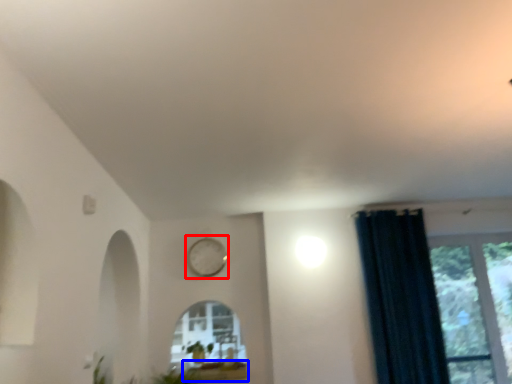
Question: Among these objects, which one is nearest to the camera, clock (highlighted by a red box) or window sill (highlighted by a blue box)?

Choices:
 (A) clock
 (B) window sill

Answer: (B)